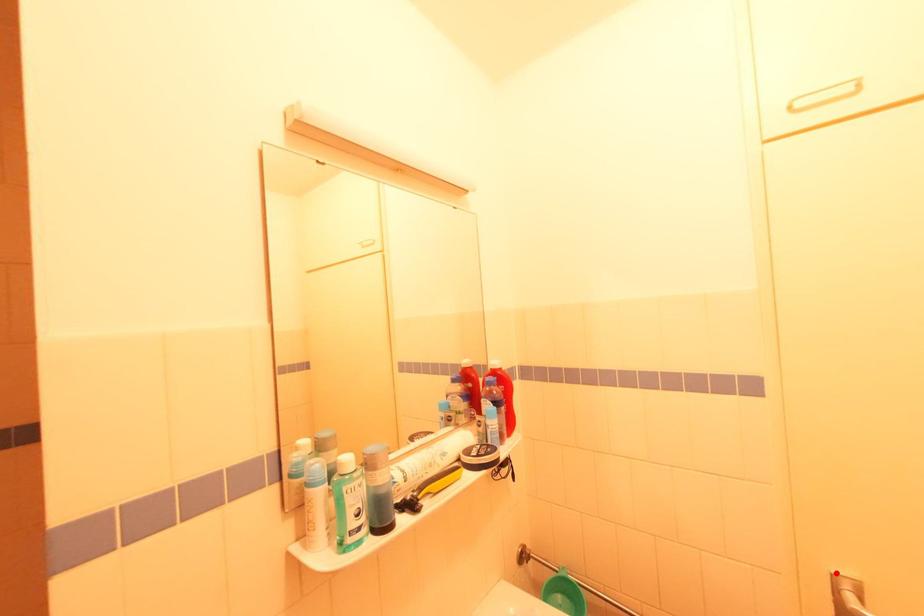
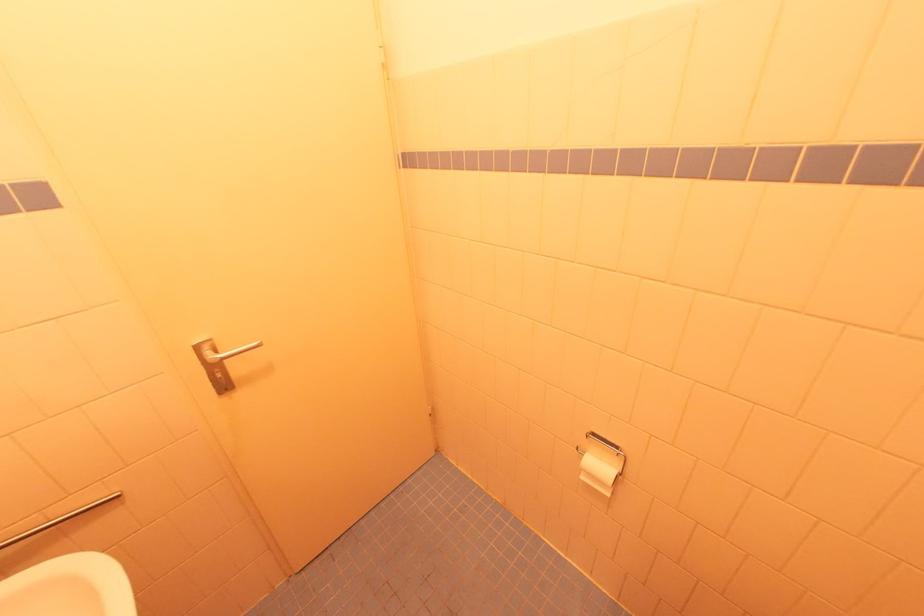
Locate, in the second image, the point that corresponds to the highlighted location in the first image.

(197, 345)